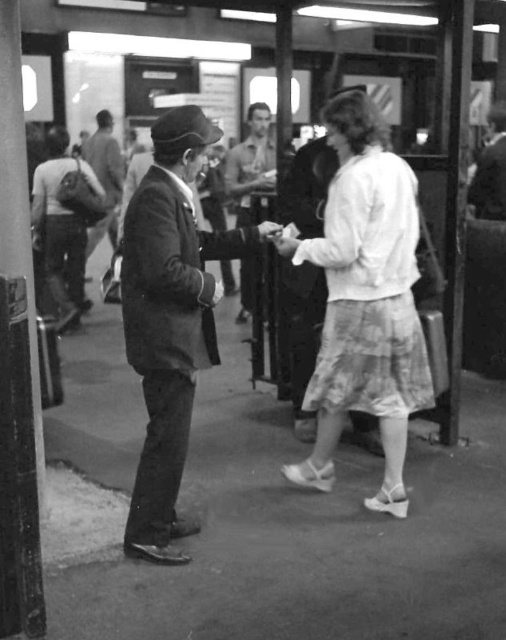
In the scene shown: You are an observer standing in the train station scene. You notice the white cotton skirt at center. Can you determine its exact location in the image using coordinates?

The white cotton skirt at center is located at point (364,300) according to the image coordinates.

You are an observer in the train station scene. You notice the white cotton skirt at center and the smooth leather jacket at upper right. Which object is taller?

The white cotton skirt at center is taller than the smooth leather jacket at upper right.